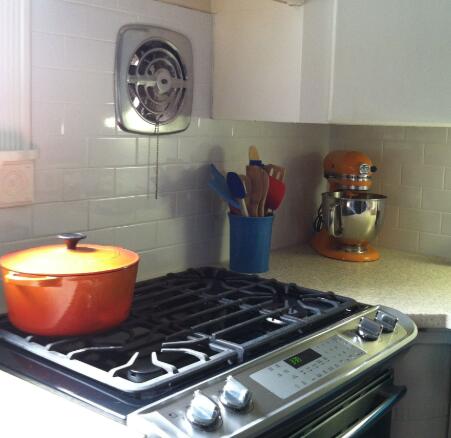
Locate an element on the screen. screen is located at coordinates (304, 358).